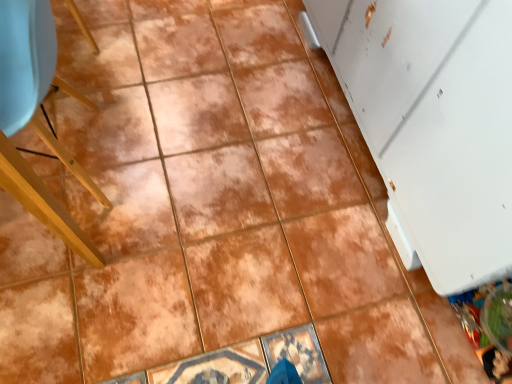
What do you see at coordinates (432, 124) in the screenshot? The image size is (512, 384). I see `white matte refrigerator at right` at bounding box center [432, 124].

Image resolution: width=512 pixels, height=384 pixels. Identify the location of white matte refrigerator at right. (432, 124).

The width and height of the screenshot is (512, 384). What are the coordinates of `matte yellow chair at left` in the screenshot? It's located at (36, 117).

The image size is (512, 384). Describe the element at coordinates (36, 117) in the screenshot. I see `matte yellow chair at left` at that location.

The height and width of the screenshot is (384, 512). In order to click on white matte refrigerator at right in this screenshot , I will do `click(432, 124)`.

Consider the image. Considering the positions of objects white matte refrigerator at right and matte yellow chair at left in the image provided, who is more to the right, white matte refrigerator at right or matte yellow chair at left?

white matte refrigerator at right is more to the right.

Between white matte refrigerator at right and matte yellow chair at left, which one is positioned in front?

white matte refrigerator at right is in front.

Is point (447, 173) positioned behind point (37, 17)?

Yes, it is.

From the image's perspective, is white matte refrigerator at right positioned above or below matte yellow chair at left?

Clearly, from the image's perspective, white matte refrigerator at right is above matte yellow chair at left.

From a real-world perspective, is white matte refrigerator at right physically located above or below matte yellow chair at left?

Clearly, from a real-world perspective, white matte refrigerator at right is above matte yellow chair at left.

Does white matte refrigerator at right have a greater width compared to matte yellow chair at left?

Yes, white matte refrigerator at right is wider than matte yellow chair at left.

Is white matte refrigerator at right taller than matte yellow chair at left?

Yes.

In terms of size, does white matte refrigerator at right appear bigger or smaller than matte yellow chair at left?

Clearly, white matte refrigerator at right is larger in size than matte yellow chair at left.

Is white matte refrigerator at right outside of matte yellow chair at left?

Yes.

Is white matte refrigerator at right placed right next to matte yellow chair at left?

No.

Is white matte refrigerator at right oriented away from matte yellow chair at left?

No, white matte refrigerator at right is not facing the opposite direction of matte yellow chair at left.

How much distance is there between white matte refrigerator at right and matte yellow chair at left?

34.48 inches.

Locate an element on the screen. This screenshot has height=384, width=512. furniture that appears on the left of white matte refrigerator at right is located at coordinates (36, 117).

Is matte yellow chair at left at the left side of white matte refrigerator at right?

Correct, you'll find matte yellow chair at left to the left of white matte refrigerator at right.

Is matte yellow chair at left closer to the viewer compared to white matte refrigerator at right?

No, matte yellow chair at left is further to the viewer.

Is point (85, 259) positioned after point (462, 260)?

Yes, it is behind point (462, 260).

From the image's perspective, is matte yellow chair at left positioned above or below white matte refrigerator at right?

Based on their image positions, matte yellow chair at left is located beneath white matte refrigerator at right.

From a real-world perspective, relative to white matte refrigerator at right, is matte yellow chair at left vertically above or below?

In terms of real-world spatial position, matte yellow chair at left is below white matte refrigerator at right.

Between matte yellow chair at left and white matte refrigerator at right, which one has larger width?

white matte refrigerator at right is wider.

Between matte yellow chair at left and white matte refrigerator at right, which one has more height?

white matte refrigerator at right is taller.

Considering the relative sizes of matte yellow chair at left and white matte refrigerator at right in the image provided, is matte yellow chair at left smaller than white matte refrigerator at right?

Indeed, matte yellow chair at left has a smaller size compared to white matte refrigerator at right.

Is matte yellow chair at left situated inside white matte refrigerator at right or outside?

matte yellow chair at left is outside white matte refrigerator at right.

Are matte yellow chair at left and white matte refrigerator at right far apart?

They are positioned close to each other.

Is matte yellow chair at left facing towards white matte refrigerator at right?

No, matte yellow chair at left is not turned towards white matte refrigerator at right.

Locate an element on the screen. Image resolution: width=512 pixels, height=384 pixels. screen door on the right of matte yellow chair at left is located at coordinates (432, 124).

Locate an element on the screen. furniture located underneath the white matte refrigerator at right (from a real-world perspective) is located at coordinates (36, 117).

In the image, there is a matte yellow chair at left. What are the coordinates of `screen door above it (from the image's perspective)` in the screenshot? It's located at (432, 124).